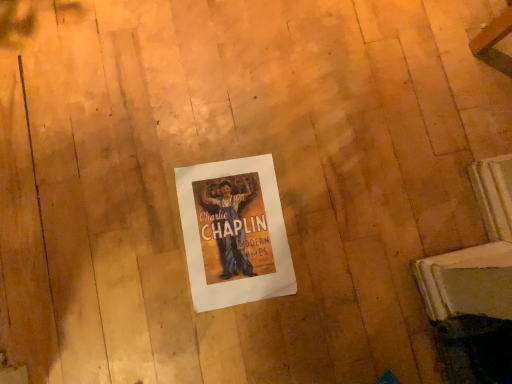
Question: Should I look upward or downward to see white paper poster at center?

Choices:
 (A) down
 (B) up

Answer: (A)